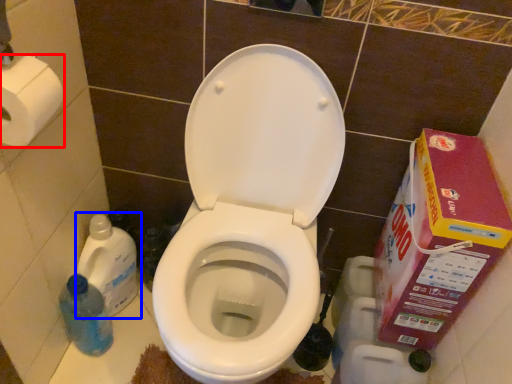
Question: Which point is further to the camera, toilet paper (highlighted by a red box) or cleaning product (highlighted by a blue box)?

Choices:
 (A) toilet paper
 (B) cleaning product

Answer: (B)